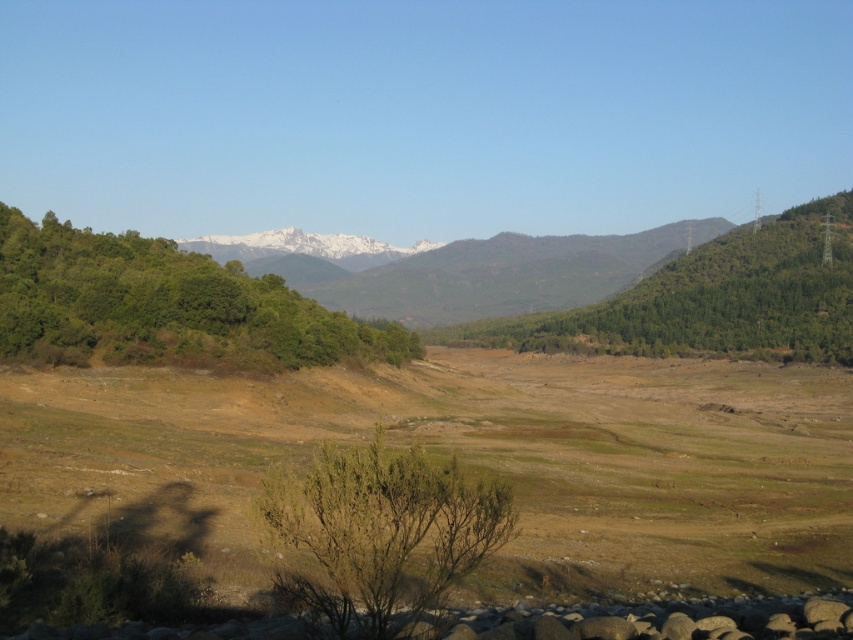
From the picture: Which is more to the left, green leafy tree at left or green leafy bush at center?

Positioned to the left is green leafy tree at left.

Between point (76, 349) and point (312, 484), which one is positioned in front?

Positioned in front is point (312, 484).

Which is behind, point (354, 349) or point (387, 477)?

The point (354, 349) is behind.

What are the coordinates of `green leafy tree at left` in the screenshot? It's located at (163, 307).

Is brown grassland at center taller than green leafy tree at center-right?

Incorrect, brown grassland at center's height is not larger of green leafy tree at center-right's.

Which is behind, point (763, 436) or point (637, 337)?

Point (637, 337)

Image resolution: width=853 pixels, height=640 pixels. I want to click on brown grassland at center, so click(467, 460).

Looking at this image, measure the distance between point (405,516) and camera.

Point (405,516) is 14.12 meters from camera.

Is green leafy bush at center thinner than green leafy tree at center-right?

Yes.

The image size is (853, 640). What do you see at coordinates (379, 536) in the screenshot?
I see `green leafy bush at center` at bounding box center [379, 536].

Locate an element on the screen. This screenshot has height=640, width=853. green leafy bush at center is located at coordinates (379, 536).